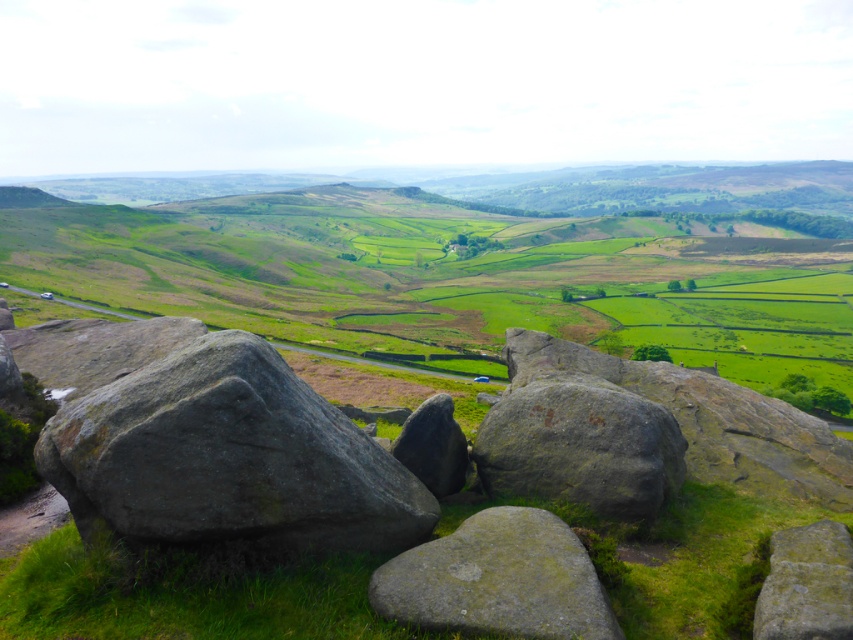
Can you confirm if rough gray rock at center is smaller than smooth gray rock at center?

Actually, rough gray rock at center might be larger than smooth gray rock at center.

Which is behind, point (357, 513) or point (424, 451)?

Point (424, 451)

At what (x,y) coordinates should I click in order to perform the action: click on rough gray rock at center. Please return your answer as a coordinate pair (x, y). The width and height of the screenshot is (853, 640). Looking at the image, I should click on (228, 460).

Locate an element on the screen. rough gray rock at center is located at coordinates (228, 460).

Is rough gray rock at center thinner than green mossy rock at lower right?

Incorrect, rough gray rock at center's width is not less than green mossy rock at lower right's.

Does point (303, 522) come in front of point (804, 532)?

That is True.

What are the coordinates of `rough gray rock at center` in the screenshot? It's located at (228, 460).

Can you confirm if gray rough rock at center is positioned below smooth gray rock at center?

Actually, gray rough rock at center is above smooth gray rock at center.

Image resolution: width=853 pixels, height=640 pixels. What do you see at coordinates (581, 445) in the screenshot? I see `gray rough rock at center` at bounding box center [581, 445].

The height and width of the screenshot is (640, 853). I want to click on gray rough rock at center, so click(x=581, y=445).

Locate an element on the screen. gray rough rock at center is located at coordinates (581, 445).